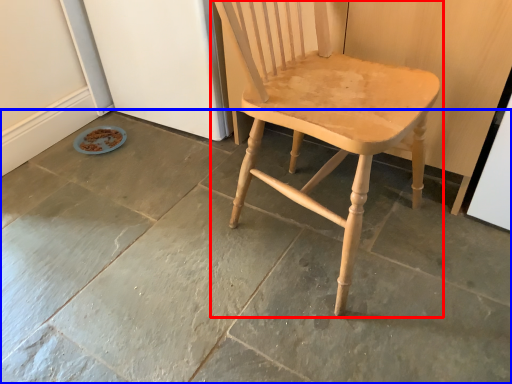
Question: Which point is further to the camera, chair (highlighted by a red box) or concrete (highlighted by a blue box)?

Choices:
 (A) chair
 (B) concrete

Answer: (B)